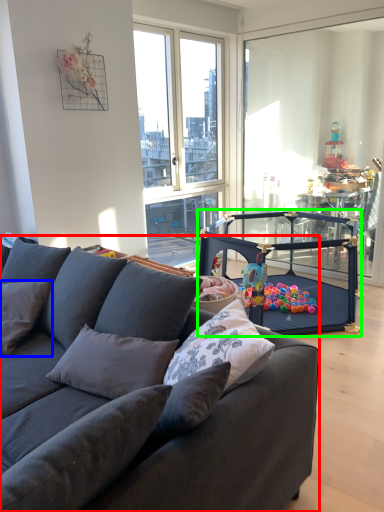
Question: Which object is the closest to the studio couch (highlighted by a red box)? Choose among these: pillow (highlighted by a blue box) or armchair (highlighted by a green box).

Choices:
 (A) pillow
 (B) armchair

Answer: (A)